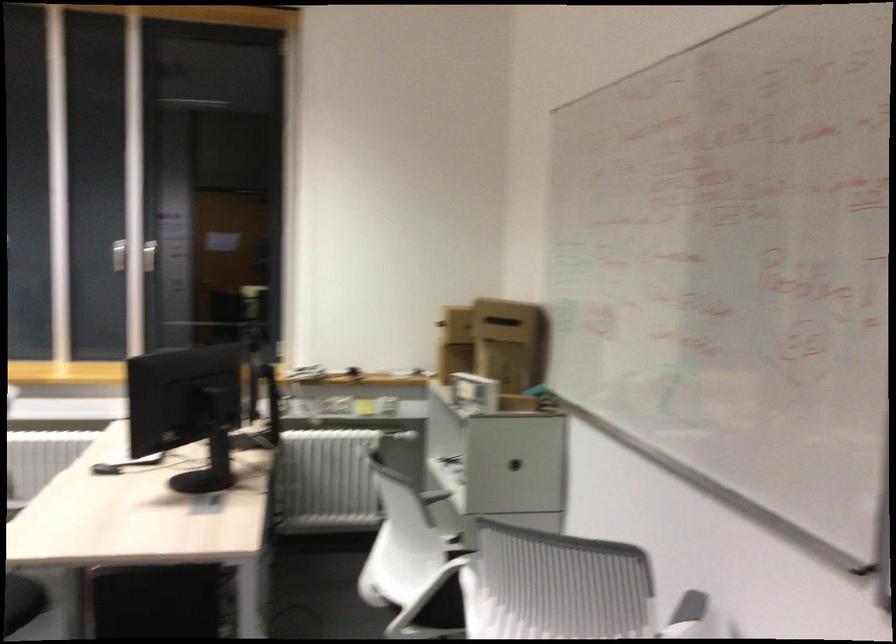
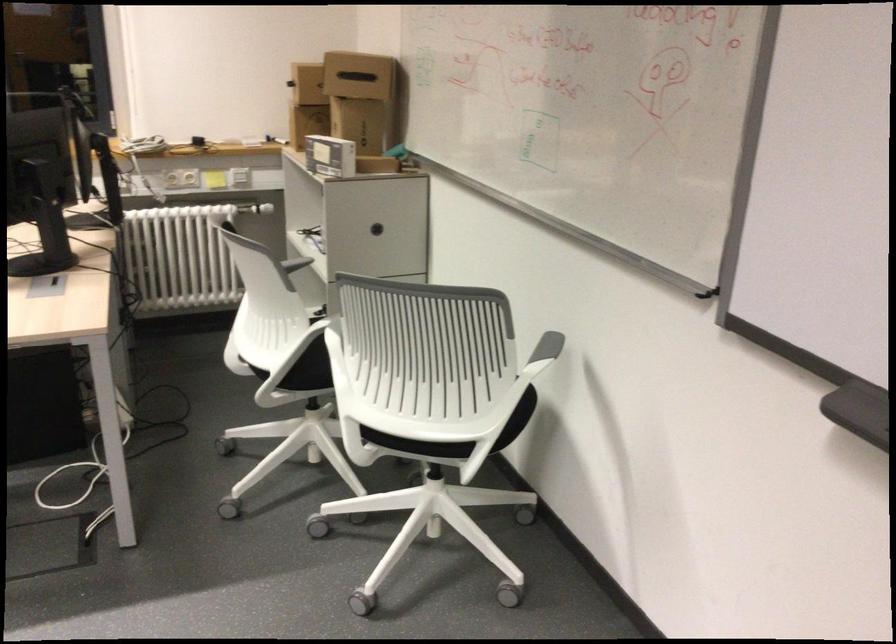
Find the pixel in the second image that matches (506,456) in the first image.

(375, 229)